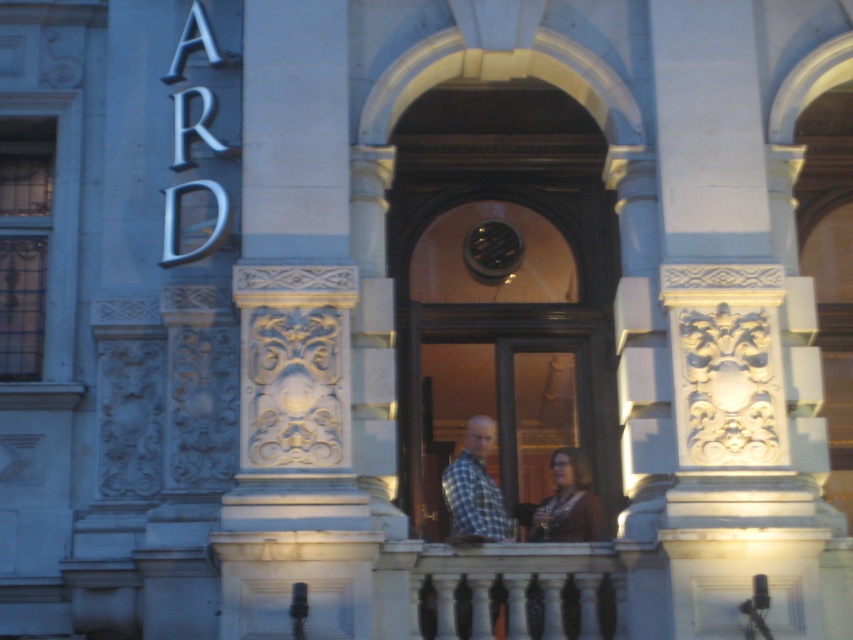
You are standing at the entrance of the building and notice two fabrics in the center area. The brown fabric at center and the plaid fabric shirt at center. If you want to reach both items, which one do you need to move closer to first?

The brown fabric at center is 6.74 feet away from the plaid fabric shirt at center. Since you are at the entrance, you would need to move towards the closer item first. However, the description only provides the distance between the two fabrics, not their individual distances from the entrance. Without knowing which is nearer to the entrance, it is impossible to determine which to reach first.

You are standing in front of the building and notice two items at the center of the image. The white stone carving at center and the matte brown sweater at center. Based on their positions, which one is closer to the left side of the building?

The white stone carving at center is to the left of the matte brown sweater at center, so it is closer to the left side of the building.